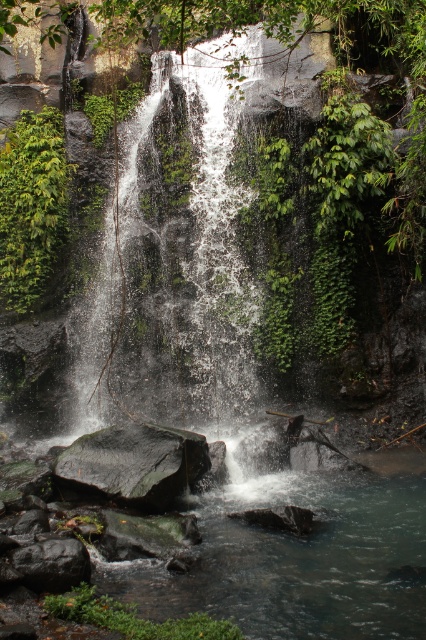
Based on the photo, is green leafy plant at left above dark gray rock at lower left?

Yes, green leafy plant at left is above dark gray rock at lower left.

Who is positioned more to the left, green leafy plant at left or dark gray rock at lower left?

From the viewer's perspective, green leafy plant at left appears more on the left side.

Who is more distant from viewer, (29, 257) or (89, 564)?

The point (29, 257) is behind.

You are a GUI agent. You are given a task and a screenshot of the screen. Output one action in this format:
    pyautogui.click(x=<x>, y=<y>)
    Task: Click on the green leafy plant at left
    Image resolution: width=426 pixels, height=640 pixels.
    Given the screenshot: What is the action you would take?
    pyautogui.click(x=31, y=205)

Can you confirm if green leafy plant at left is thinner than green mossy rock at lower center?

In fact, green leafy plant at left might be wider than green mossy rock at lower center.

Between point (26, 228) and point (97, 600), which one is positioned in front?

Point (97, 600) is more forward.

Between point (45, 275) and point (201, 632), which one is positioned behind?

The point (45, 275) is more distant.

The height and width of the screenshot is (640, 426). I want to click on green leafy plant at left, so (31, 205).

Locate an element on the screen. green mossy rock at lower center is located at coordinates (135, 618).

Which is above, green mossy rock at lower center or dark gray rock at lower left?

dark gray rock at lower left is above.

Identify the location of green mossy rock at lower center. This screenshot has height=640, width=426. (135, 618).

This screenshot has width=426, height=640. In order to click on green mossy rock at lower center in this screenshot , I will do `click(135, 618)`.